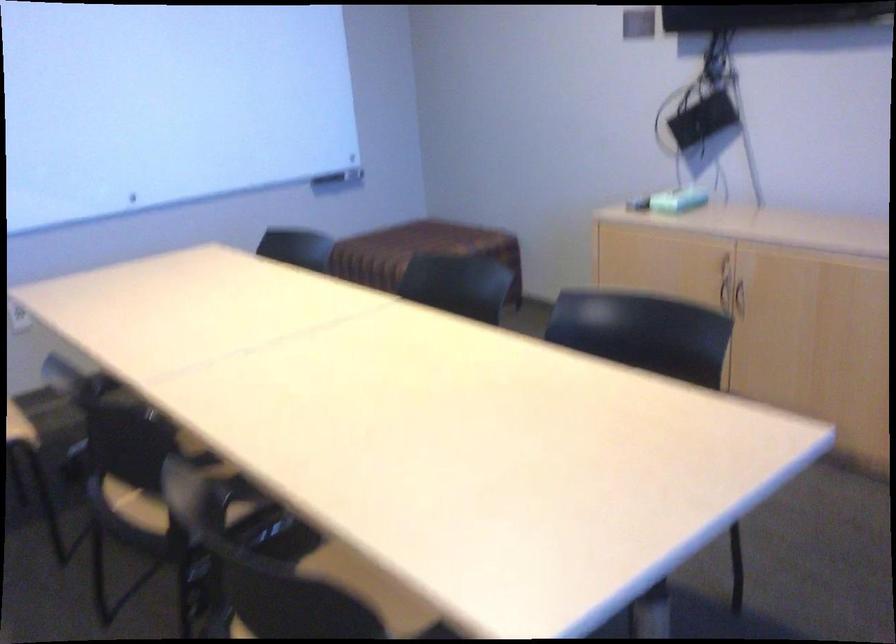
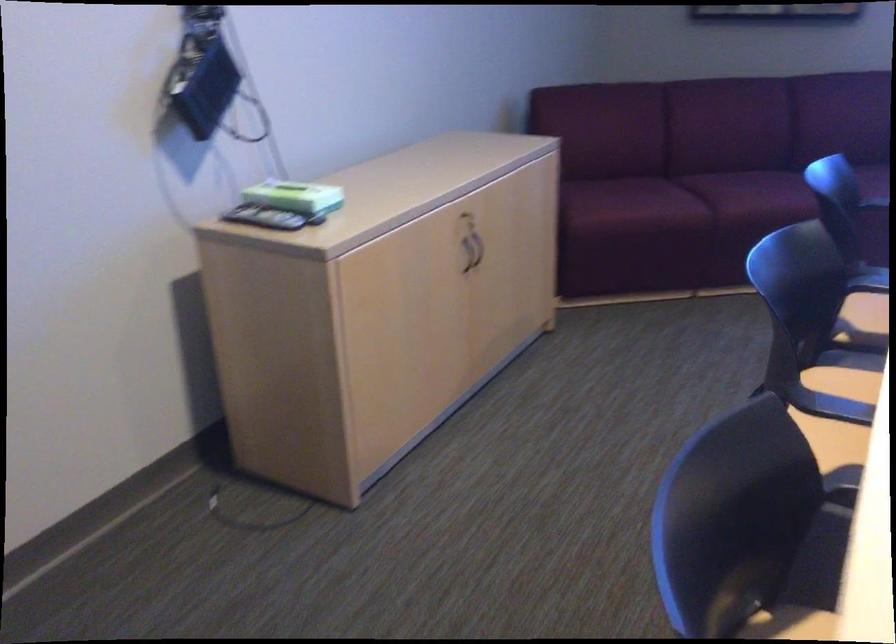
Find the pixel in the second image that matches (x=675, y=191) in the first image.

(287, 196)